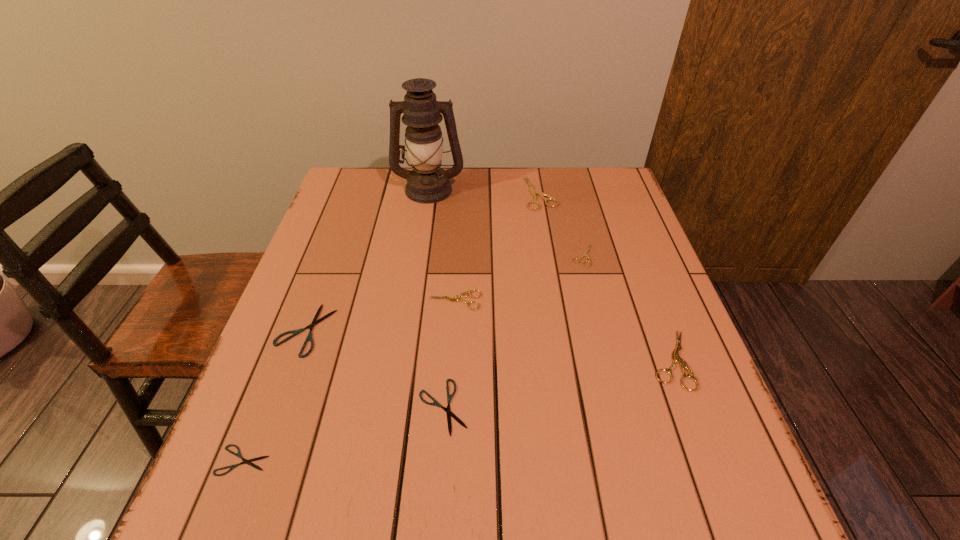
Locate an element on the screen. The width and height of the screenshot is (960, 540). free space located 0.060m on the front of the third nearest beige shears is located at coordinates (590, 284).

This screenshot has height=540, width=960. What are the coordinates of `free space located on the left of the rightmost black shears` in the screenshot? It's located at (249, 407).

Where is `free space located on the right of the shortest shears`? The height and width of the screenshot is (540, 960). free space located on the right of the shortest shears is located at coordinates (309, 460).

Image resolution: width=960 pixels, height=540 pixels. I want to click on oil lamp that is at the far edge, so click(427, 183).

At what (x,y) coordinates should I click in order to perform the action: click on shears that is at the far edge. Please return your answer as a coordinate pair (x, y). This screenshot has height=540, width=960. Looking at the image, I should click on (534, 193).

In the image, there is a desktop. Where is `free region at the far edge`? The height and width of the screenshot is (540, 960). free region at the far edge is located at coordinates (517, 174).

Identify the location of vacant space at the near edge. The height and width of the screenshot is (540, 960). (477, 504).

Where is `free space at the left edge of the desktop`? free space at the left edge of the desktop is located at coordinates (358, 230).

At what (x,y) coordinates should I click in order to perform the action: click on blank space at the right edge of the desktop. Please return your answer as a coordinate pair (x, y). The width and height of the screenshot is (960, 540). Looking at the image, I should click on pos(635,245).

The width and height of the screenshot is (960, 540). In the image, there is a desktop. Identify the location of vacant region at the near left corner. (200, 514).